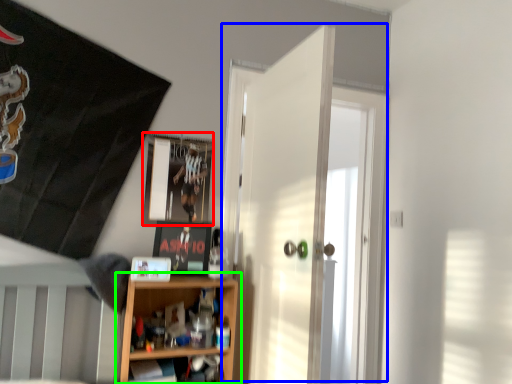
Question: Which is nearer to the picture frame (highlighted by a red box)? door (highlighted by a blue box) or shelf (highlighted by a green box).

Choices:
 (A) door
 (B) shelf

Answer: (A)